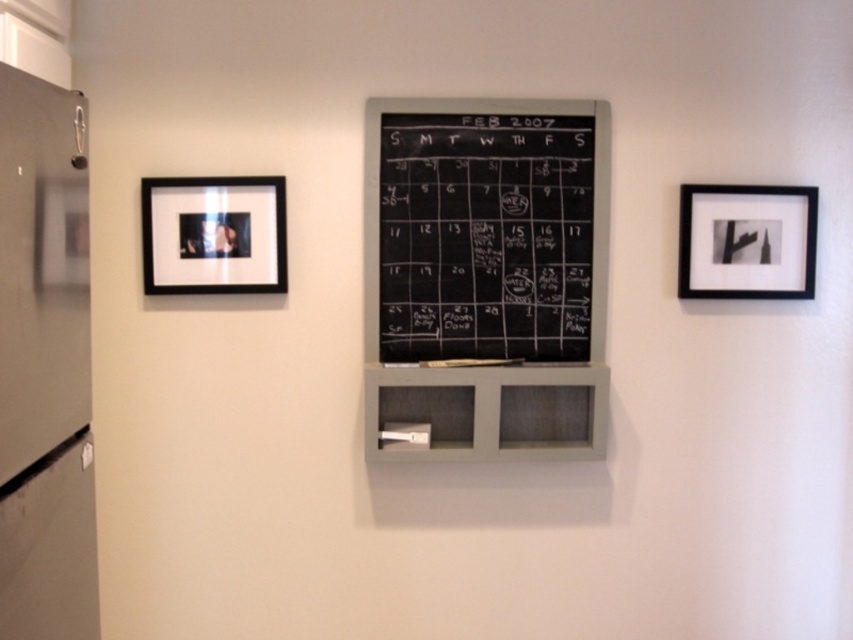
Question: Is black matte picture frame at left smaller than black matte picture frame at right?

Choices:
 (A) no
 (B) yes

Answer: (B)

Question: Which point is closer to the camera?

Choices:
 (A) (177, 284)
 (B) (416, 200)
 (C) (39, 600)

Answer: (C)

Question: Which object appears closest to the camera in this image?

Choices:
 (A) metallic refrigerator at left
 (B) black matte picture frame at right

Answer: (A)

Question: Is black chalkboard at center smaller than black matte picture frame at right?

Choices:
 (A) yes
 (B) no

Answer: (B)

Question: Which point is closer to the camera taking this photo?

Choices:
 (A) (247, 244)
 (B) (804, 268)
 (C) (444, 211)

Answer: (A)

Question: In this image, where is black chalkboard at center located relative to metallic refrigerator at left?

Choices:
 (A) right
 (B) left

Answer: (A)